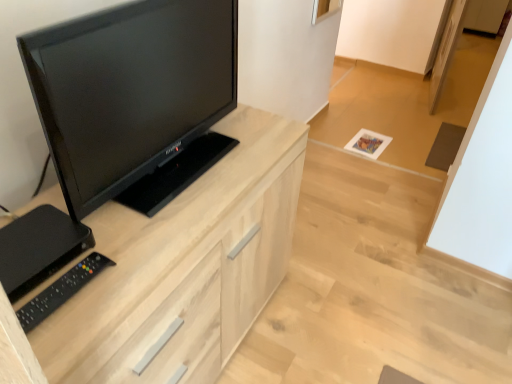
Question: Relative to light wood cabinet at center, is black glossy tv at left in front or behind?

Choices:
 (A) behind
 (B) front

Answer: (B)

Question: Looking at the image, does black glossy tv at left seem bigger or smaller compared to light wood cabinet at center?

Choices:
 (A) small
 (B) big

Answer: (A)

Question: Considering the real-world distances, which object is closest to the black plastic remote at lower left?

Choices:
 (A) black glossy tv at left
 (B) light wood cabinet at center

Answer: (B)

Question: Which object is positioned farthest from the black plastic remote at lower left?

Choices:
 (A) black glossy tv at left
 (B) light wood cabinet at center

Answer: (A)